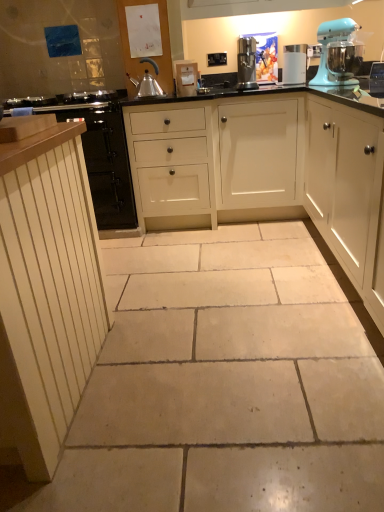
Question: Can you confirm if white wood cabinets at center, the second cabinetry positioned from the right, is shorter than white wood cabinet at left, the fourth cabinetry viewed from the right?

Choices:
 (A) no
 (B) yes

Answer: (A)

Question: From a real-world perspective, is white wood cabinets at center, positioned as the 3th cabinetry in left-to-right order, positioned over white wood cabinet at left, which is counted as the first cabinetry, starting from the left, based on gravity?

Choices:
 (A) no
 (B) yes

Answer: (A)

Question: Is white wood cabinets at center, positioned as the 3th cabinetry in left-to-right order, at the left side of white wood cabinet at left, the fourth cabinetry viewed from the right?

Choices:
 (A) no
 (B) yes

Answer: (A)

Question: Would you say white wood cabinet at left, which is counted as the first cabinetry, starting from the left, is part of white wood cabinets at center, positioned as the 3th cabinetry in left-to-right order,'s contents?

Choices:
 (A) no
 (B) yes

Answer: (A)

Question: Can you confirm if white wood cabinets at center, the second cabinetry positioned from the right, is positioned to the right of white wood cabinet at left, which is counted as the first cabinetry, starting from the left?

Choices:
 (A) yes
 (B) no

Answer: (A)

Question: Looking at their shapes, would you say white matte cabinet at right, which ranks as the 4th cabinetry in left-to-right order, is wider or thinner than satin silver coffee maker at upper center, the first kitchen appliance when ordered from left to right?

Choices:
 (A) wide
 (B) thin

Answer: (A)

Question: Is white matte cabinet at right, the first cabinetry when ordered from right to left, bigger or smaller than satin silver coffee maker at upper center, placed as the second kitchen appliance when sorted from right to left?

Choices:
 (A) small
 (B) big

Answer: (B)

Question: In the image, is white matte cabinet at right, the first cabinetry when ordered from right to left, on the left side or the right side of satin silver coffee maker at upper center, the first kitchen appliance when ordered from left to right?

Choices:
 (A) right
 (B) left

Answer: (A)

Question: From their relative heights in the image, would you say white matte cabinet at right, which ranks as the 4th cabinetry in left-to-right order, is taller or shorter than satin silver coffee maker at upper center, the first kitchen appliance when ordered from left to right?

Choices:
 (A) short
 (B) tall

Answer: (B)

Question: Is beige stone floor at center wider or thinner than satin silver coffee maker at upper center, the first kitchen appliance when ordered from left to right?

Choices:
 (A) thin
 (B) wide

Answer: (B)

Question: Is beige stone floor at center in front of or behind satin silver coffee maker at upper center, placed as the second kitchen appliance when sorted from right to left, in the image?

Choices:
 (A) front
 (B) behind

Answer: (A)

Question: From a real-world perspective, is beige stone floor at center above or below satin silver coffee maker at upper center, the first kitchen appliance when ordered from left to right?

Choices:
 (A) above
 (B) below

Answer: (B)

Question: Is beige stone floor at center bigger or smaller than satin silver coffee maker at upper center, placed as the second kitchen appliance when sorted from right to left?

Choices:
 (A) small
 (B) big

Answer: (B)

Question: Is white matte cabinet at right, which ranks as the 4th cabinetry in left-to-right order, wider or thinner than white wood cabinets at center, positioned as the 3th cabinetry in left-to-right order?

Choices:
 (A) wide
 (B) thin

Answer: (B)

Question: Considering the positions of white matte cabinet at right, the first cabinetry when ordered from right to left, and white wood cabinets at center, positioned as the 3th cabinetry in left-to-right order, in the image, is white matte cabinet at right, the first cabinetry when ordered from right to left, bigger or smaller than white wood cabinets at center, positioned as the 3th cabinetry in left-to-right order,?

Choices:
 (A) big
 (B) small

Answer: (B)